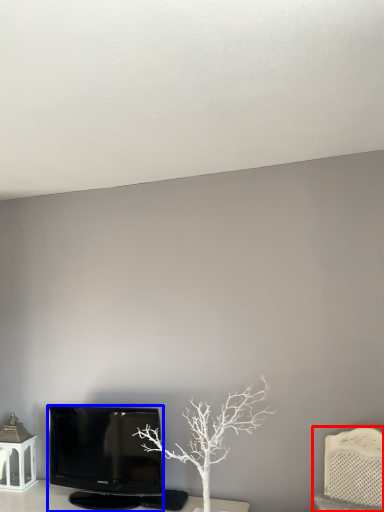
Question: Which object is closer to the camera taking this photo, furniture (highlighted by a red box) or television (highlighted by a blue box)?

Choices:
 (A) furniture
 (B) television

Answer: (A)